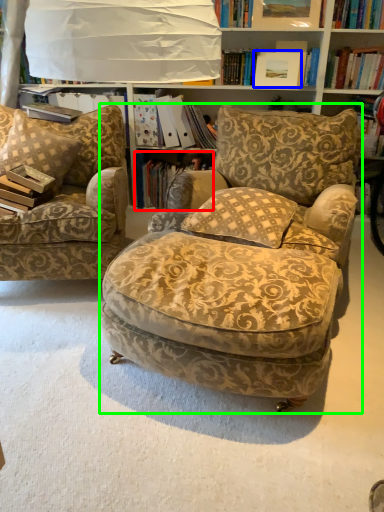
Question: Which is nearer to the book (highlighted by a red box)? picture frame (highlighted by a blue box) or chair (highlighted by a green box).

Choices:
 (A) picture frame
 (B) chair

Answer: (A)